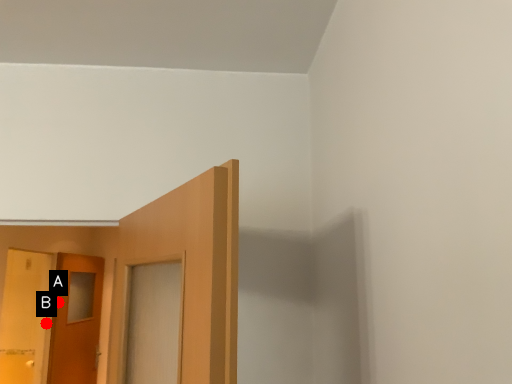
Question: Two points are circled on the image, labeled by A and B beside each circle. Which point is farther to the camera?

Choices:
 (A) A is further
 (B) B is further

Answer: (A)